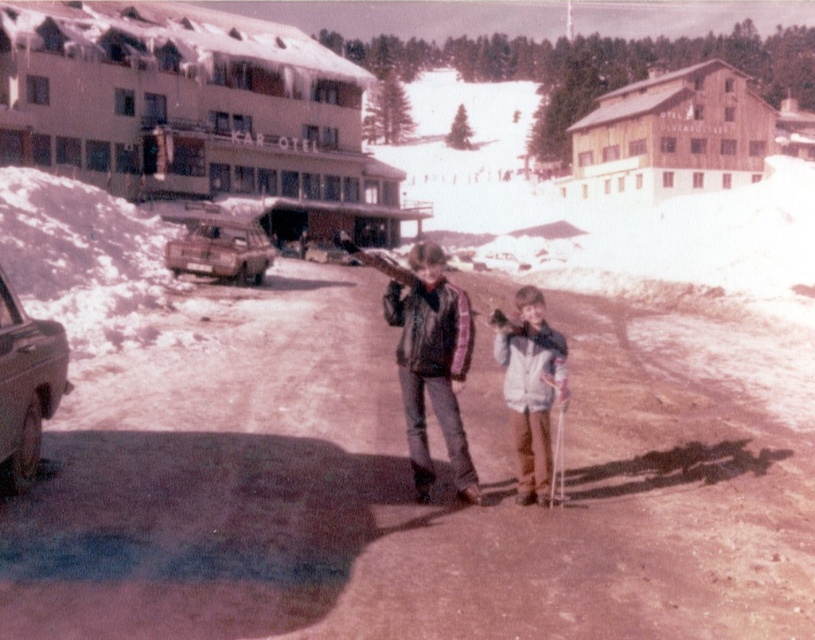
Question: Can you confirm if shiny silver sedan at left is positioned to the right of rusty metallic truck at center-left?

Choices:
 (A) no
 (B) yes

Answer: (B)

Question: Based on their relative distances, which object is nearer to the rusty metallic truck at center-left?

Choices:
 (A) leather jacket at center
 (B) white matte jacket at center
 (C) shiny silver sedan at left

Answer: (B)

Question: Does white matte jacket at center appear under shiny silver sedan at left?

Choices:
 (A) no
 (B) yes

Answer: (A)

Question: Which point is closer to the camera?

Choices:
 (A) (413, 392)
 (B) (14, 480)

Answer: (B)

Question: Can you confirm if white matte jacket at center is positioned below shiny silver sedan at left?

Choices:
 (A) no
 (B) yes

Answer: (A)

Question: Which point is farther to the camera?

Choices:
 (A) (175, 253)
 (B) (421, 256)
 (C) (510, 348)

Answer: (A)